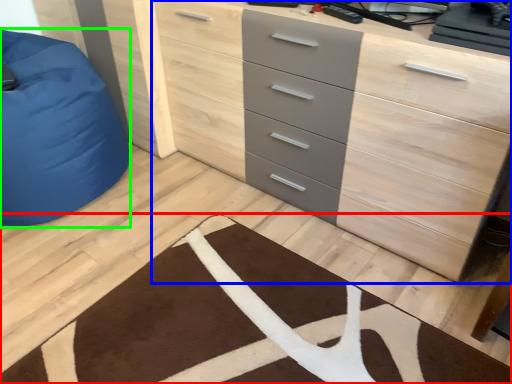
Question: Considering the real-world distances, which object is farthest from doormat (highlighted by a red box)? chest of drawers (highlighted by a blue box) or furniture (highlighted by a green box)?

Choices:
 (A) chest of drawers
 (B) furniture

Answer: (B)